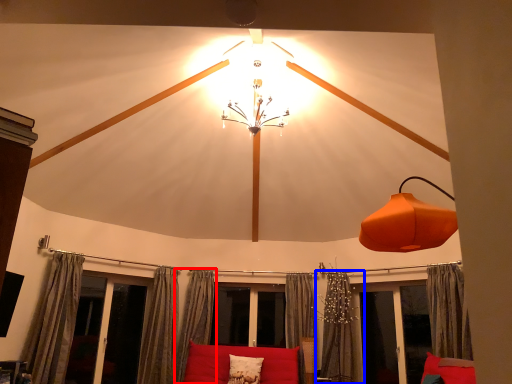
Question: Which of the following is the farthest to the observer, curtain (highlighted by a red box) or curtain (highlighted by a blue box)?

Choices:
 (A) curtain
 (B) curtain

Answer: (A)